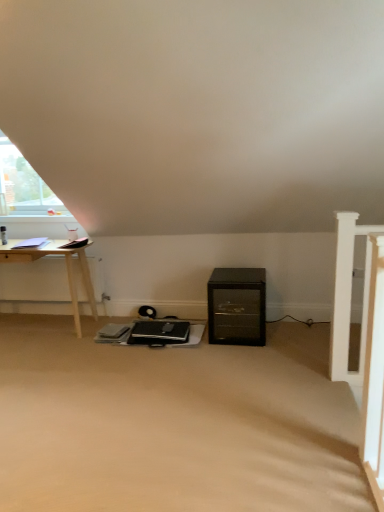
What do you see at coordinates (237, 306) in the screenshot? The width and height of the screenshot is (384, 512). I see `black glass cabinet at center` at bounding box center [237, 306].

You are a GUI agent. You are given a task and a screenshot of the screen. Output one action in this format:
    pyautogui.click(x=<x>, y=<y>)
    Task: Click on the black glass cabinet at center
    
    Given the screenshot: What is the action you would take?
    pyautogui.click(x=237, y=306)

Measure the distance between point (264, 287) and camera.

Point (264, 287) and camera are 3.57 meters apart.

I want to click on black glass cabinet at center, so click(x=237, y=306).